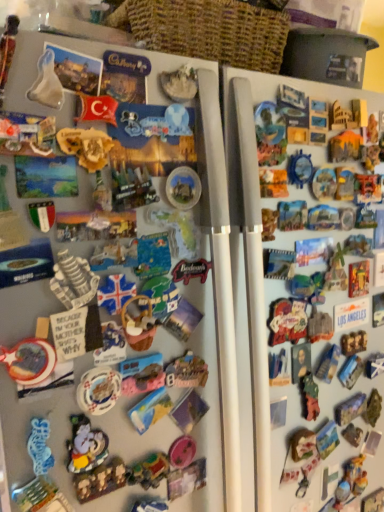
Question: From a real-world perspective, is matte plastic magnet at upper left, which is counted as the ninth toy, starting from the bottom, above or below matte plastic button at right?

Choices:
 (A) above
 (B) below

Answer: (A)

Question: Considering the positions of matte plastic magnet at upper left, the 10th toy in the back-to-front sequence, and matte plastic button at right in the image, is matte plastic magnet at upper left, the 10th toy in the back-to-front sequence, taller or shorter than matte plastic button at right?

Choices:
 (A) short
 (B) tall

Answer: (A)

Question: Which of these objects is positioned closest to the woven brown basket at upper center?

Choices:
 (A) translucent plastic toy at center, which is the sixth toy from bottom to top
 (B) matte plastic magnet at upper left, the 10th toy in the back-to-front sequence
 (C) white marble statue at center, the 8th toy in the left-to-right sequence
 (D) wooden toy horse at lower right, the 1th toy viewed from the right
 (E) matte plastic toy at center, the 3th toy positioned from the back

Answer: (C)

Question: Based on their relative distances, which object is nearer to the plush toy at center, the 3th toy from the front?

Choices:
 (A) wooden toy horse at lower right, which appears as the first toy when ordered from the bottom
 (B) white marble statue at center, the third toy viewed from the right
 (C) matte plastic toy at center, marked as the second toy in a bottom-to-top arrangement
 (D) matte yellow map at center, placed as the eighth toy when sorted from bottom to top
 (E) white glossy plate at lower left, which is the 7th toy in right-to-left order

Answer: (E)